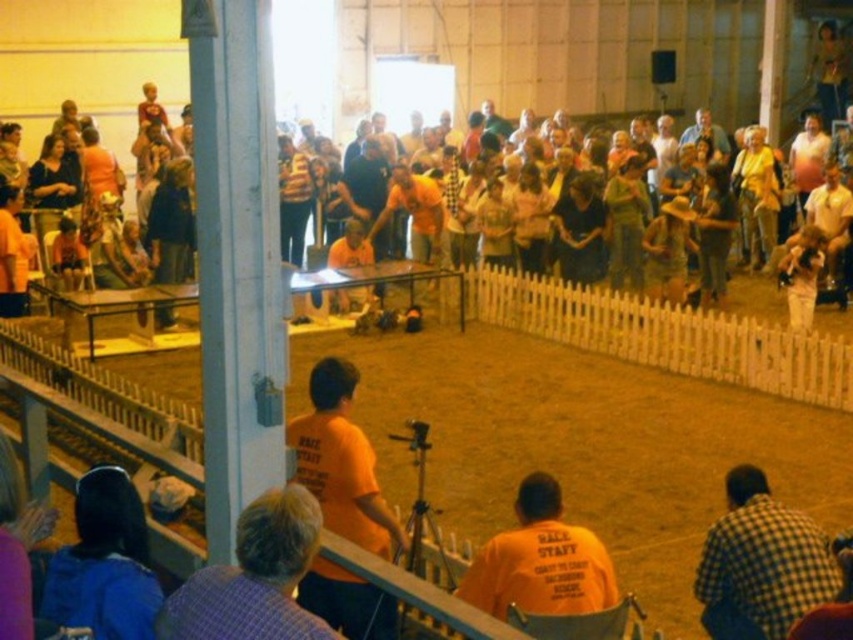
Question: Is orange shirted people at center behind striped sweater at center?

Choices:
 (A) no
 (B) yes

Answer: (A)

Question: Which object is the closest to the checkered fabric shirt at lower right?

Choices:
 (A) striped sweater at center
 (B) orange cotton shirt at lower center
 (C) orange shirted people at center

Answer: (B)

Question: Can you confirm if checkered fabric shirt at lower right is positioned above orange shirted people at center?

Choices:
 (A) no
 (B) yes

Answer: (A)

Question: Among these points, which one is nearest to the camera?

Choices:
 (A) (108, 168)
 (B) (523, 534)

Answer: (B)

Question: Which is farther from the blue plaid shirt at lower left?

Choices:
 (A) blue fabric at lower left
 (B) checkered fabric shirt at lower right
 (C) orange shirted people at center
 (D) orange cotton shirt at lower center

Answer: (C)

Question: Does checkered fabric shirt at lower right have a larger size compared to blue fabric at lower left?

Choices:
 (A) yes
 (B) no

Answer: (A)